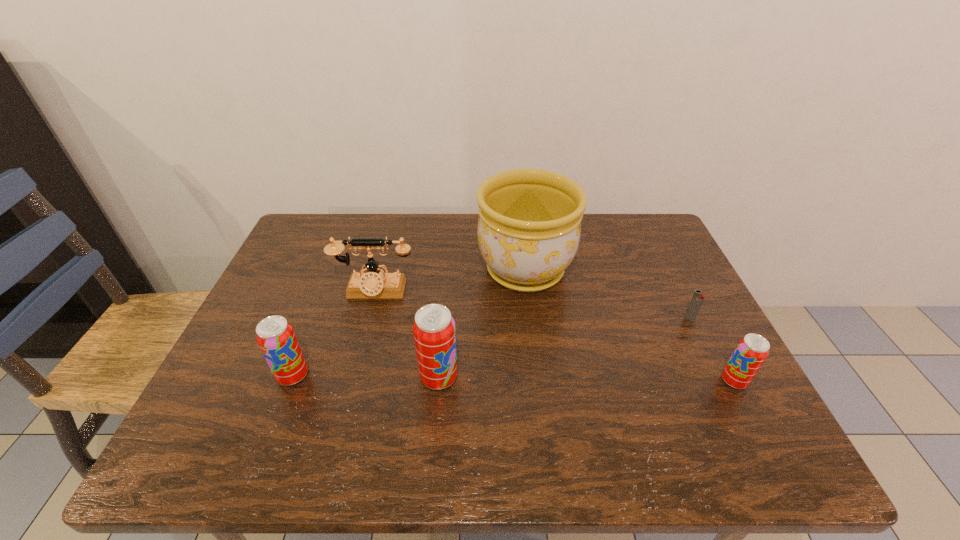
The height and width of the screenshot is (540, 960). Find the location of `the leftmost soda can`. the leftmost soda can is located at coordinates (276, 338).

The image size is (960, 540). In order to click on the fourth object from right to left in this screenshot , I will do `click(434, 332)`.

Find the location of a particular element. the second soda can from left to right is located at coordinates (434, 332).

The height and width of the screenshot is (540, 960). I want to click on the rightmost soda can, so click(x=750, y=353).

Locate an element on the screen. The image size is (960, 540). the shortest soda can is located at coordinates (750, 353).

Locate an element on the screen. flowerpot is located at coordinates (529, 226).

The width and height of the screenshot is (960, 540). What are the coordinates of `the tallest object` in the screenshot? It's located at (529, 226).

Identify the location of telephone. The height and width of the screenshot is (540, 960). (375, 284).

Where is `igniter`? This screenshot has width=960, height=540. igniter is located at coordinates (698, 297).

Image resolution: width=960 pixels, height=540 pixels. Find the location of `the shortest object`. the shortest object is located at coordinates (698, 297).